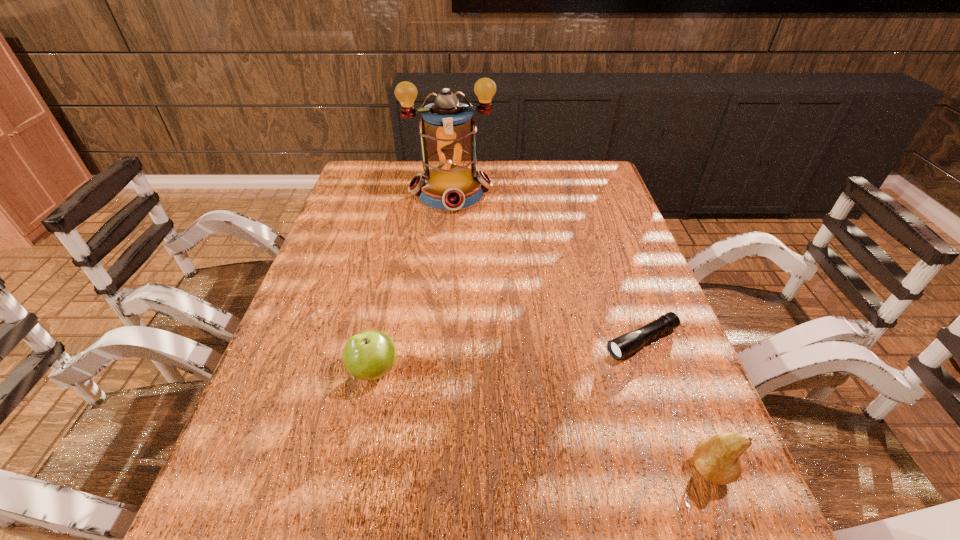
This screenshot has height=540, width=960. In order to click on vacant spot on the desktop that is between the apple and the pear and is positioned on the front-facing side of the farthest object in this screenshot , I will do `click(484, 403)`.

The image size is (960, 540). Identify the location of free space on the desktop that is between the apple and the nearest object and is positioned at the lens end of the flashlight. (512, 411).